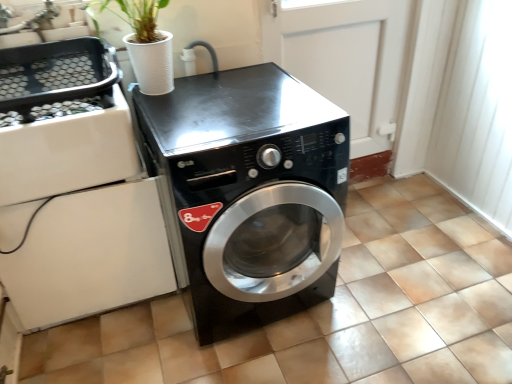
The image size is (512, 384). What are the coordinates of `free location in front of white glossy door at center` in the screenshot? It's located at (371, 230).